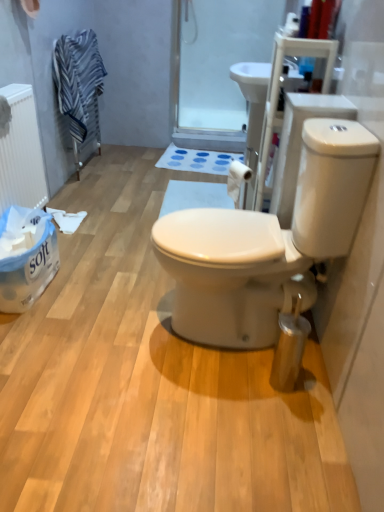
Identify the location of vacant space to the right of white matte radiator at left. The height and width of the screenshot is (512, 384). (99, 260).